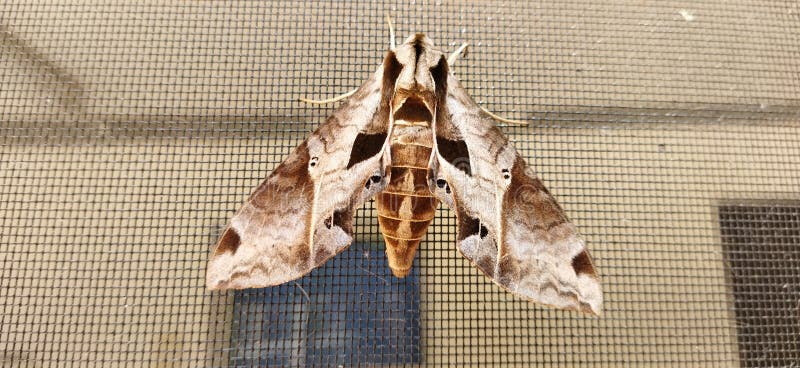
Identify the location of wall. (126, 258).